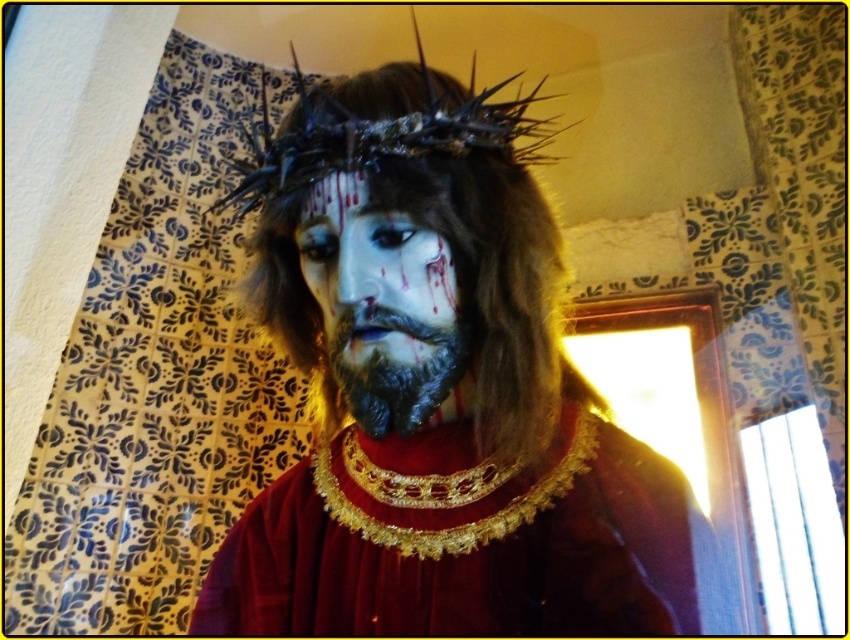
You are a makeup artist preparing to apply the beard to the face. Given the distance between the matte black face at center and the dark matte beard at center, do you think there is enough space to attach the beard without overlapping the face?

The matte black face at center is 0.64 inches from the dark matte beard at center, so there is sufficient space to attach the beard without overlapping the face.

What are the coordinates of the matte black face at center in the image?

The coordinates of the matte black face at center are at point (380,298).

From the picture: You are an art restorer examining the costume and makeup of the person in the image. You need to apply a protective coating to both the gold textured necklace at center and the matte black forehead at center. Which object should you treat first based on their positions relative to you?

The gold textured necklace at center is closer to you than the matte black forehead at center, so you should treat the gold textured necklace at center first.